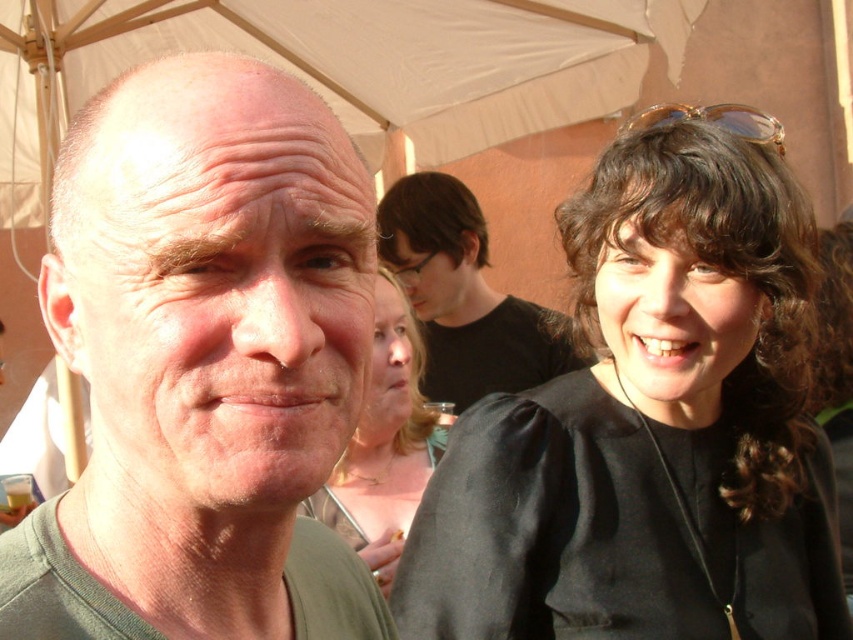
How far apart are black matte shirt at upper right and white fabric canopy at upper center?

5.35 feet

Who is more distant from viewer, (686, 337) or (677, 16)?

The point (677, 16) is behind.

Locate an element on the screen. This screenshot has width=853, height=640. black matte shirt at upper right is located at coordinates (650, 428).

Is the position of black matte shirt at upper right more distant than that of translucent amber sunglasses at upper right?

No, it is in front of translucent amber sunglasses at upper right.

Can you confirm if black matte shirt at upper right is thinner than translucent amber sunglasses at upper right?

Incorrect, black matte shirt at upper right's width is not less than translucent amber sunglasses at upper right's.

What do you see at coordinates (650, 428) in the screenshot? The image size is (853, 640). I see `black matte shirt at upper right` at bounding box center [650, 428].

Image resolution: width=853 pixels, height=640 pixels. Identify the location of black matte shirt at upper right. coord(650,428).

Which is above, white fabric canopy at upper center or black matte shirt at center?

white fabric canopy at upper center is higher up.

Between white fabric canopy at upper center and black matte shirt at center, which one has more height?

With more height is black matte shirt at center.

Locate an element on the screen. The image size is (853, 640). white fabric canopy at upper center is located at coordinates (340, 67).